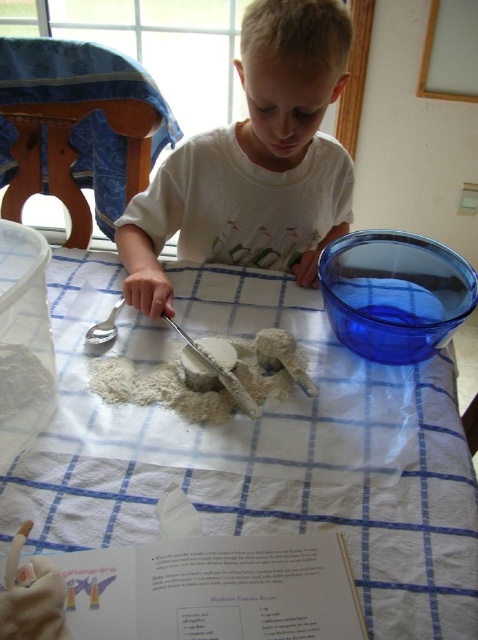
What do you see at coordinates (264, 451) in the screenshot? The width and height of the screenshot is (478, 640). I see `white paper towel at center` at bounding box center [264, 451].

Between white paper towel at center and white matte dough at center, which one has more height?

white paper towel at center is taller.

Is point (369, 611) farther from camera compared to point (228, 381)?

That is False.

Find the location of a particular element. white paper towel at center is located at coordinates (264, 451).

Which is more to the left, white paper towel at center or white matte shirt at upper center?

From the viewer's perspective, white paper towel at center appears more on the left side.

Which is more to the right, white paper towel at center or white matte shirt at upper center?

Positioned to the right is white matte shirt at upper center.

Who is more forward, (58, 451) or (337, 3)?

Point (58, 451) is more forward.

Identify the location of white paper towel at center. The width and height of the screenshot is (478, 640). (264, 451).

Is white matte shirt at upper center thinner than white matte dough at center?

Incorrect, white matte shirt at upper center's width is not less than white matte dough at center's.

Who is shorter, white matte shirt at upper center or white matte dough at center?

With less height is white matte dough at center.

Which is behind, point (300, 83) or point (289, 356)?

The point (289, 356) is more distant.

You are a GUI agent. You are given a task and a screenshot of the screen. Output one action in this format:
    pyautogui.click(x=<x>, y=<y>)
    Task: Click on the white matte shirt at upper center
    The width and height of the screenshot is (478, 640).
    Given the screenshot: What is the action you would take?
    (x=253, y=163)